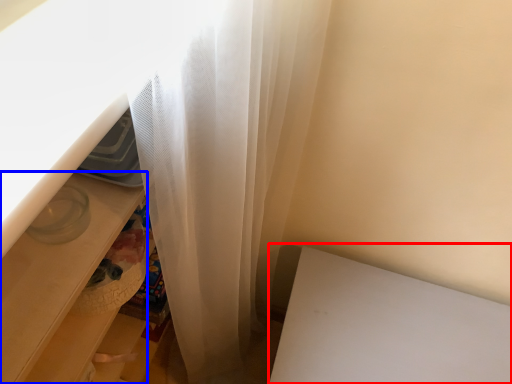
Question: Among these objects, which one is nearest to the camera, table (highlighted by a red box) or drawer (highlighted by a blue box)?

Choices:
 (A) table
 (B) drawer

Answer: (B)